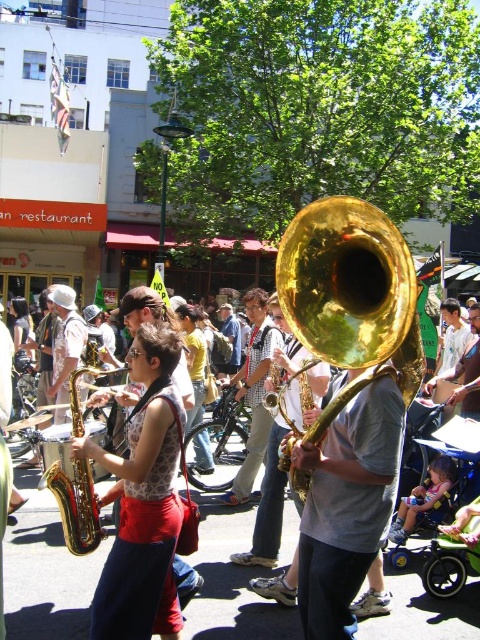
Question: Does gold shiny tuba at center appear over shiny gold saxophone at center?

Choices:
 (A) yes
 (B) no

Answer: (A)

Question: Which object is positioned farthest from the gold shiny tuba at center?

Choices:
 (A) matte gold saxophone at center
 (B) shiny gold saxophone at center

Answer: (B)

Question: Which object is positioned farthest from the shiny gold saxophone at center?

Choices:
 (A) matte gold saxophone at center
 (B) gold shiny tuba at center

Answer: (B)

Question: Can you confirm if gold shiny tuba at center is positioned to the right of shiny gold saxophone at center?

Choices:
 (A) yes
 (B) no

Answer: (A)

Question: Observing the image, what is the correct spatial positioning of matte gold saxophone at center in reference to shiny gold saxophone at center?

Choices:
 (A) left
 (B) right

Answer: (A)

Question: Which object is the farthest from the shiny gold saxophone at center?

Choices:
 (A) matte gold saxophone at center
 (B) gold shiny tuba at center

Answer: (B)